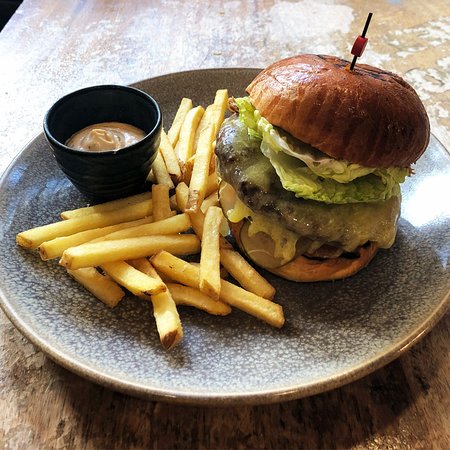
At what (x,y) coordinates should I click in order to perform the action: click on plate. Please return your answer as a coordinate pair (x, y). Image resolution: width=450 pixels, height=450 pixels. Looking at the image, I should click on (305, 356).